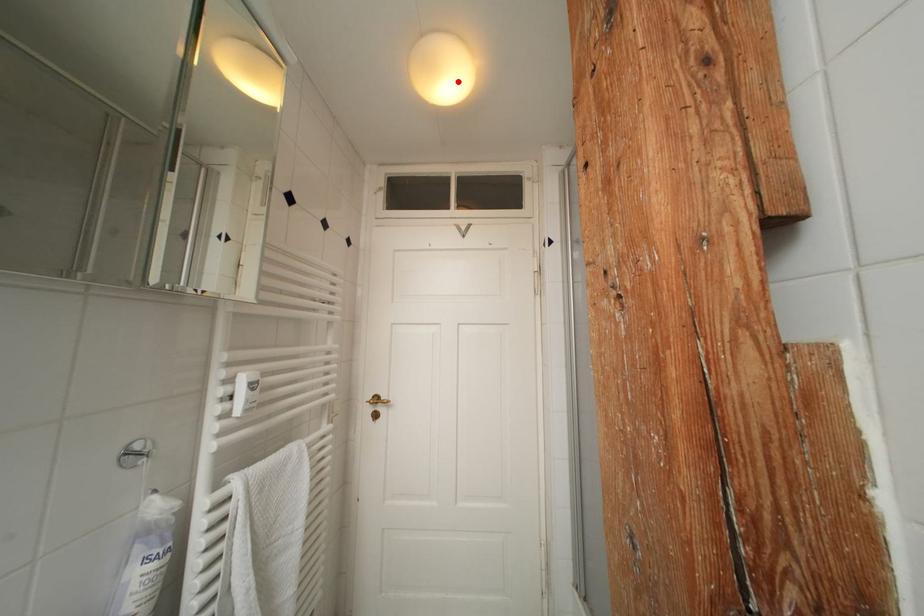
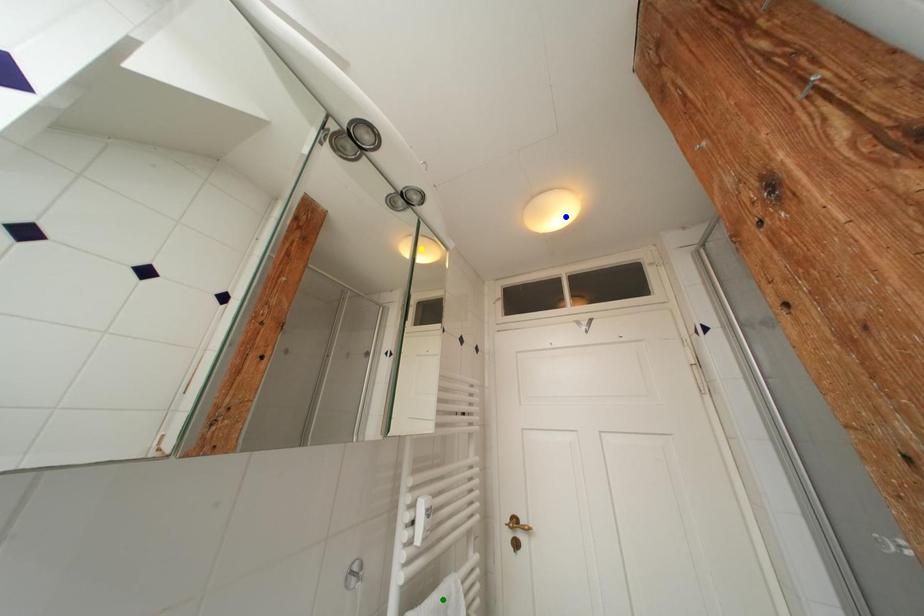
Question: I am providing you with two images of the same scene from different viewpoints. A red point is marked on the first image. You are given multiple points on the second image. Which spot in image 2 lines up with the point in image 1?

Choices:
 (A) blue point
 (B) yellow point
 (C) green point

Answer: (A)